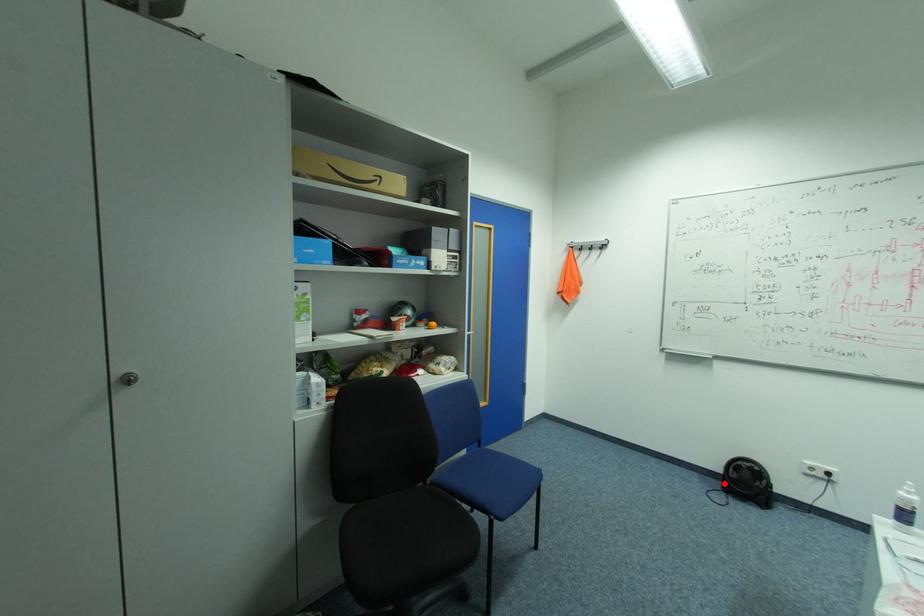
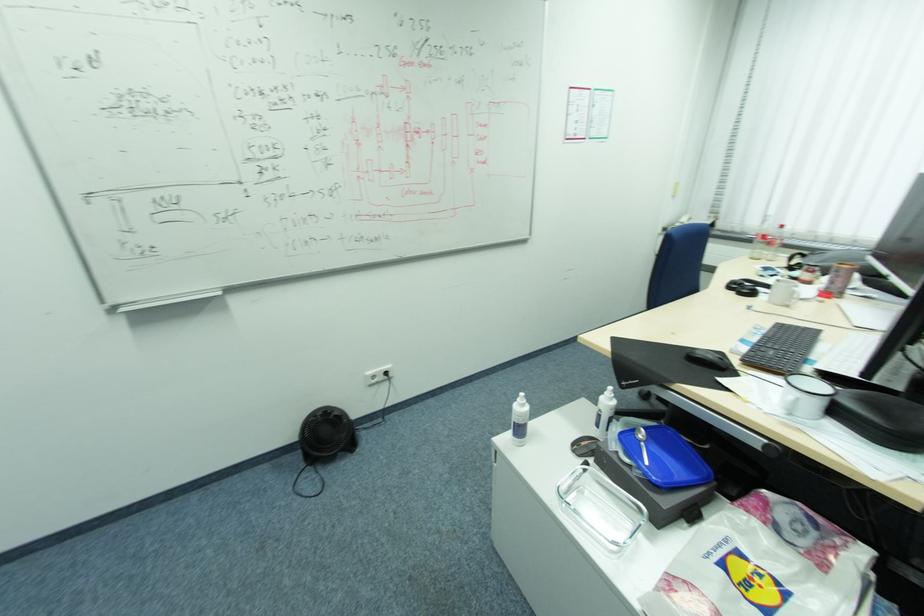
Question: A red point is marked in image1. In image2, is the corresponding 3D point closer to the camera or farther? Reply with the corresponding letter.

Choices:
 (A) The corresponding 3D point is closer.
 (B) The corresponding 3D point is farther.

Answer: (B)